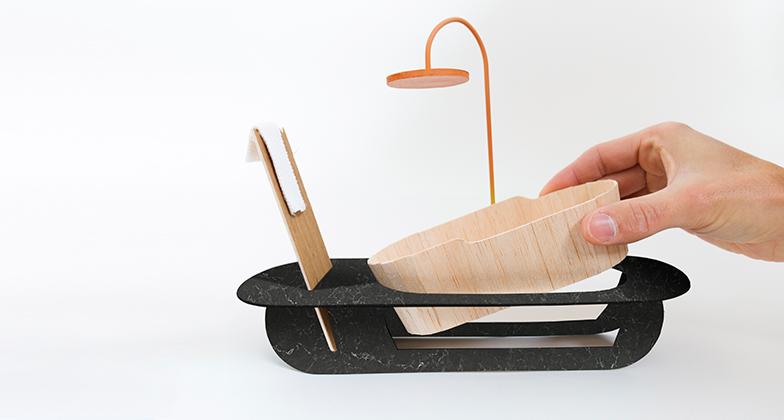
Identify the location of miniature bath tub. Image resolution: width=784 pixels, height=420 pixels. (270, 287).